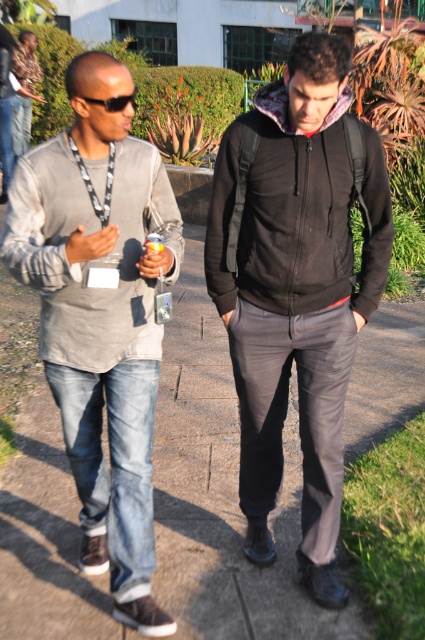
Does black fleece jacket at center lie in front of gray cotton jacket at left?

No.

Locate an element on the screen. This screenshot has width=425, height=640. black fleece jacket at center is located at coordinates (283, 212).

Is point (348, 284) closer to camera compared to point (50, 225)?

No, (348, 284) is further to viewer.

You are a GUI agent. You are given a task and a screenshot of the screen. Output one action in this format:
    pyautogui.click(x=<x>, y=<y>)
    Task: Click on the black fleece jacket at center
    The height and width of the screenshot is (640, 425).
    Given the screenshot: What is the action you would take?
    pyautogui.click(x=283, y=212)

Can you confirm if black matte hoodie at center is shorter than black fleece jacket at center?

Incorrect, black matte hoodie at center's height does not fall short of black fleece jacket at center's.

At what (x,y) coordinates should I click in order to perform the action: click on black matte hoodie at center. Please return your answer as a coordinate pair (x, y). The image size is (425, 640). Looking at the image, I should click on (297, 285).

Does point (187, 240) lie in front of point (248, 115)?

No, it is behind (248, 115).

Which of these two, gray concrete pavement at center or black matte hoodie at center, stands shorter?

gray concrete pavement at center is shorter.

Is point (215, 504) behind point (277, 429)?

Yes, point (215, 504) is farther from viewer.

Locate an element on the screen. gray concrete pavement at center is located at coordinates (221, 493).